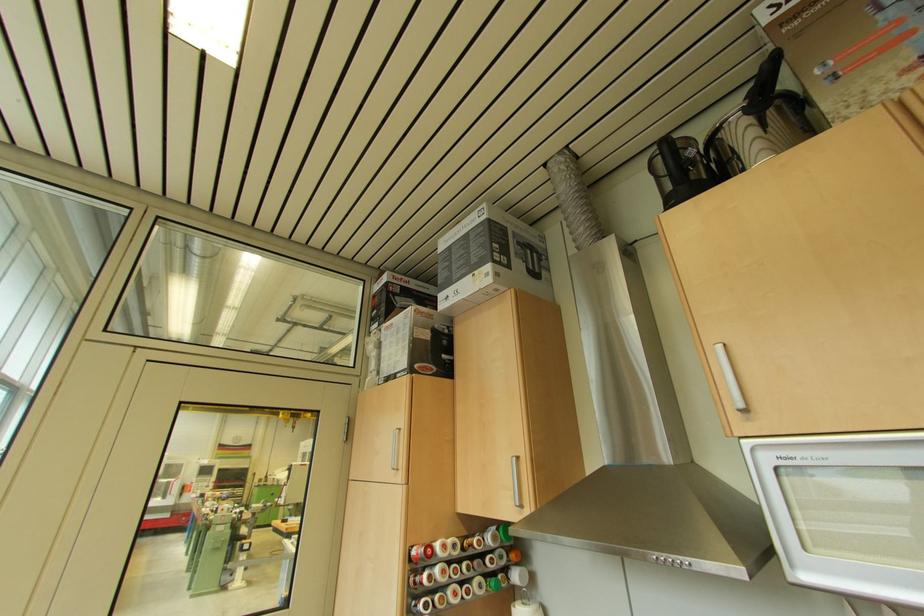
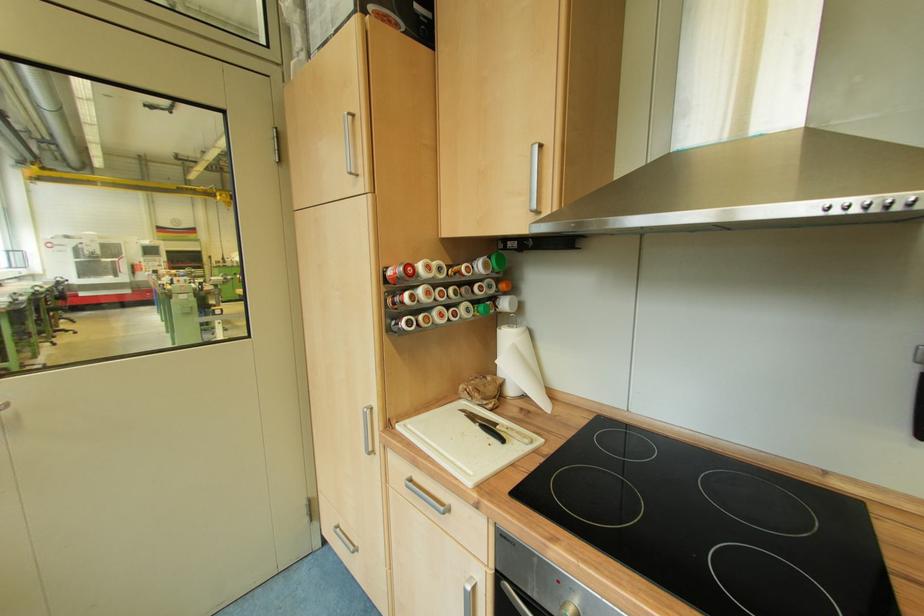
Question: The images are taken continuously from a first-person perspective. In which direction is your viewpoint rotating?

Choices:
 (A) Left
 (B) Right
 (C) Up
 (D) Down

Answer: (D)